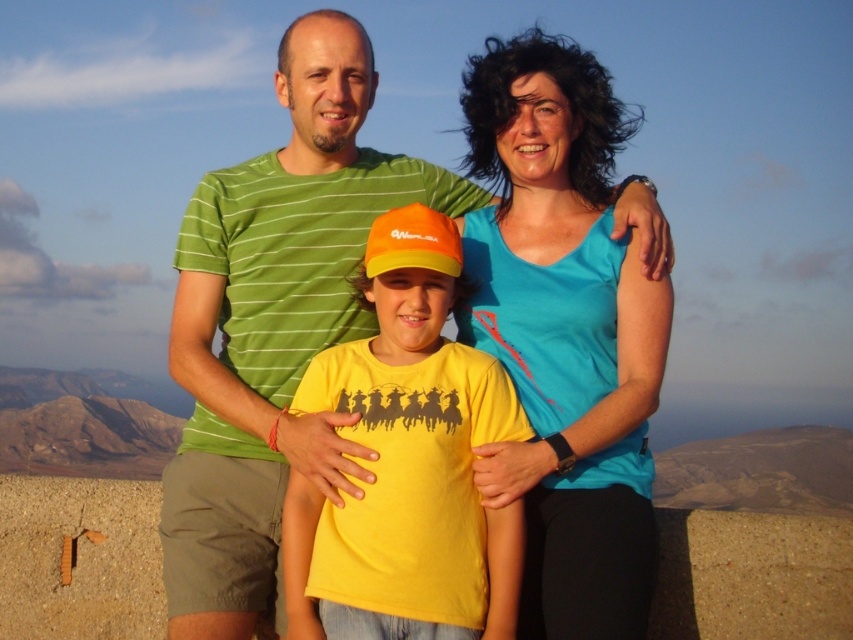
Question: Which point is closer to the camera taking this photo?

Choices:
 (A) (305, 492)
 (B) (563, 317)
 (C) (294, 356)

Answer: (A)

Question: Does blue fabric tank top at upper center appear under yellow matte t-shirt at center?

Choices:
 (A) no
 (B) yes

Answer: (A)

Question: Which object is positioned farthest from the yellow matte t-shirt at center?

Choices:
 (A) blue fabric tank top at upper center
 (B) green striped shirt at upper center

Answer: (B)

Question: Which of the following is the closest to the observer?

Choices:
 (A) (345, 234)
 (B) (567, 292)

Answer: (B)

Question: In this image, where is green striped shirt at upper center located relative to yellow matte t-shirt at center?

Choices:
 (A) right
 (B) left

Answer: (B)

Question: Where is green striped shirt at upper center located in relation to blue fabric tank top at upper center in the image?

Choices:
 (A) left
 (B) right

Answer: (A)